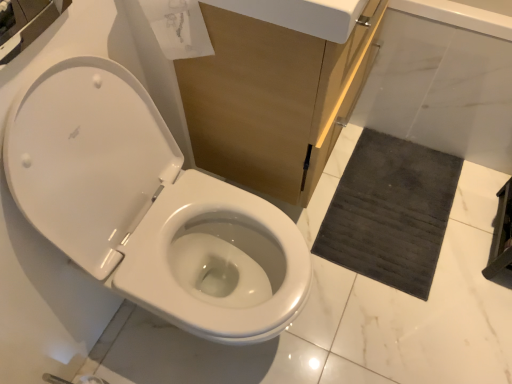
At what (x,y) coordinates should I click in order to perform the action: click on empty space that is to the right of matte wood cabinet at center. Please return your answer as a coordinate pair (x, y). Looking at the image, I should click on (404, 197).